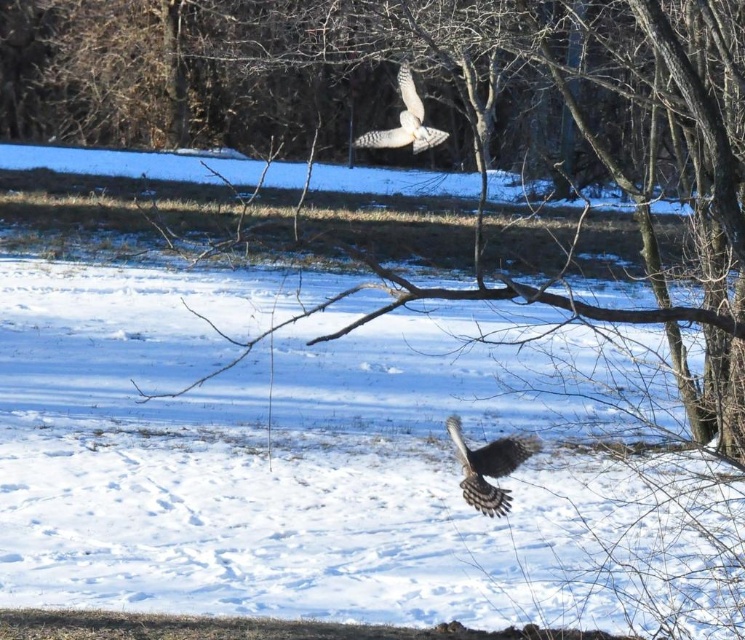
You are standing in the snowy landscape and see the speckled brown hawk at center. If you want to take a photo of it with your camera that has a maximum zoom range of 5 meters, will you be able to get a clear closeup shot?

The speckled brown hawk at center is 6.58 meters away from the camera. Since your camera can only zoom up to 5 meters, you won t be able to get a clear closeup shot of the speckled brown hawk at center.

You are an ornithologist observing the winter scene. You notice two distinct features in the sky. One is the speckled brown hawk at center and the other is the white speckled feathers at upper center. Which of these two features is located higher in the sky?

The white speckled feathers at upper center is higher in the sky because the speckled brown hawk at center is positioned under it.